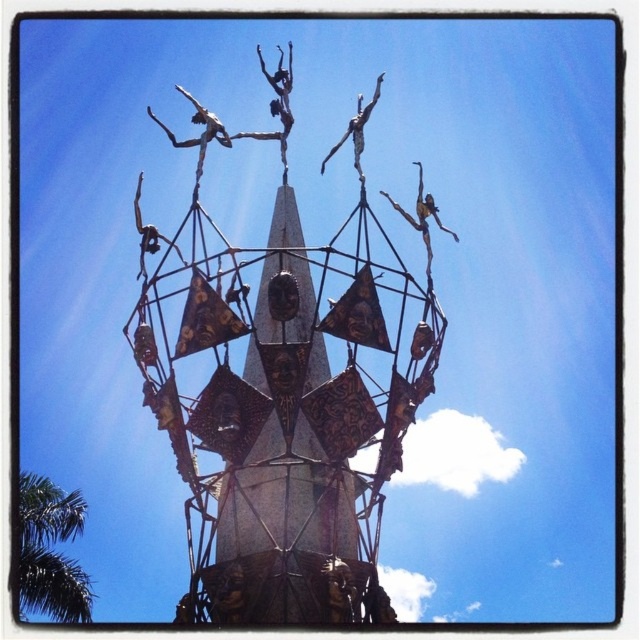
Can you confirm if green leafy tree at lower left is positioned to the left of polished bronze dancers at upper center?

Yes, green leafy tree at lower left is to the left of polished bronze dancers at upper center.

Locate an element on the screen. green leafy tree at lower left is located at coordinates (51, 552).